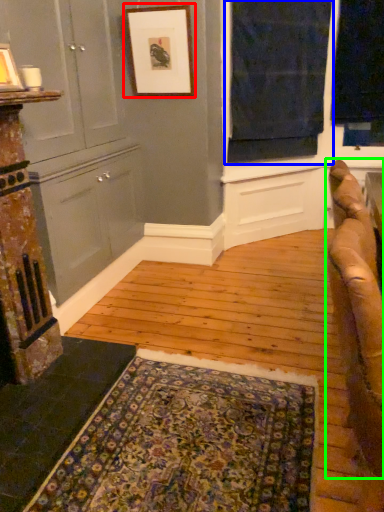
Question: Considering the real-world distances, which object is closest to picture frame (highlighted by a red box)? window (highlighted by a blue box) or studio couch (highlighted by a green box).

Choices:
 (A) window
 (B) studio couch

Answer: (A)